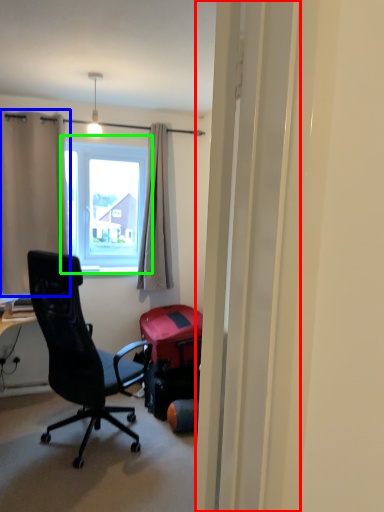
Question: Based on their relative distances, which object is farther from screen door (highlighted by a red box)? Choose from curtain (highlighted by a blue box) and window (highlighted by a green box).

Choices:
 (A) curtain
 (B) window

Answer: (B)